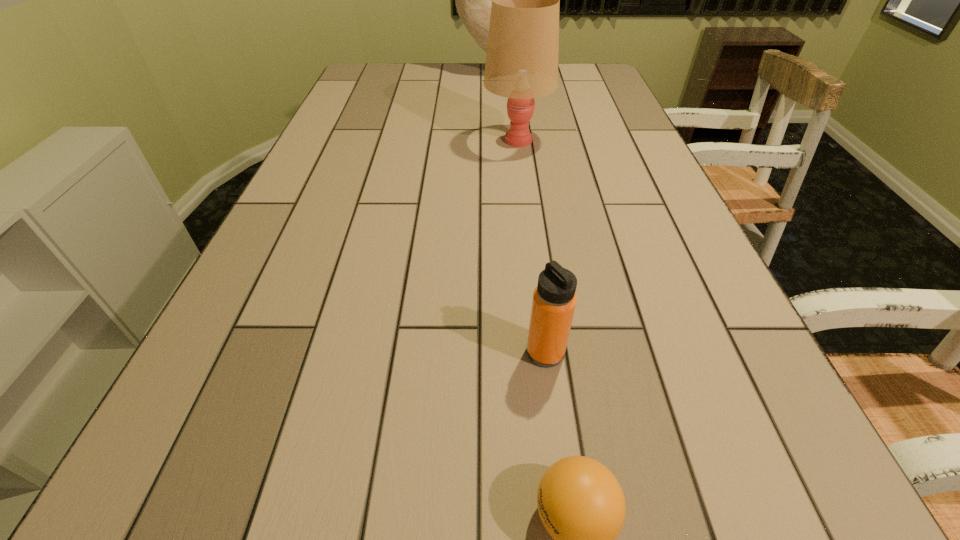
What are the coordinates of `free space at the left edge of the desktop` in the screenshot? It's located at (316, 139).

Where is `free space at the right edge`? Image resolution: width=960 pixels, height=540 pixels. free space at the right edge is located at coordinates (636, 197).

Identify the location of free space at the far left corner of the desktop. (376, 85).

You are a GUI agent. You are given a task and a screenshot of the screen. Output one action in this format:
    pyautogui.click(x=<x>, y=<y>)
    Task: Click on the vacant space at the far right corner
    The width and height of the screenshot is (960, 540).
    Given the screenshot: What is the action you would take?
    point(599,82)

Where is `vacant space in between the parakeet and the second nearest object`? vacant space in between the parakeet and the second nearest object is located at coordinates (518, 213).

At what (x,y) coordinates should I click in order to perform the action: click on vacant space in between the farthest object and the lampshade. Please return your answer as a coordinate pair (x, y). This screenshot has width=960, height=540. Looking at the image, I should click on (504, 106).

I want to click on vacant area that lies between the lampshade and the third farthest object, so click(x=531, y=246).

This screenshot has height=540, width=960. Find the location of `free space between the parakeet and the lampshade`. free space between the parakeet and the lampshade is located at coordinates (504, 106).

Find the location of a particular element. unoccupied position between the lampshade and the second nearest object is located at coordinates (531, 246).

The height and width of the screenshot is (540, 960). What are the coordinates of `vacant area that lies between the lampshade and the thermos bottle` in the screenshot? It's located at (531, 246).